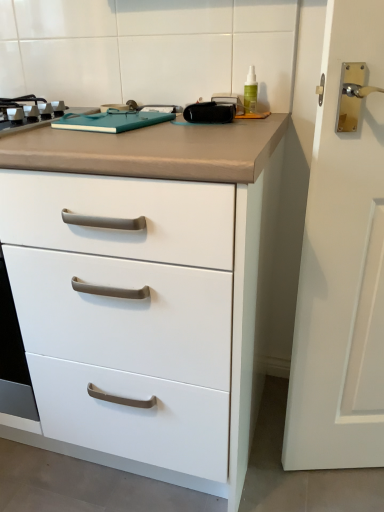
Question: Does white matte chest of drawers at center turn towards green translucent bottle at upper right?

Choices:
 (A) no
 (B) yes

Answer: (A)

Question: Is white matte chest of drawers at center far from green translucent bottle at upper right?

Choices:
 (A) no
 (B) yes

Answer: (A)

Question: Is white matte chest of drawers at center positioned beyond the bounds of green translucent bottle at upper right?

Choices:
 (A) yes
 (B) no

Answer: (A)

Question: Is white matte chest of drawers at center next to green translucent bottle at upper right and touching it?

Choices:
 (A) yes
 (B) no

Answer: (B)

Question: Considering the relative sizes of white matte chest of drawers at center and green translucent bottle at upper right in the image provided, is white matte chest of drawers at center bigger than green translucent bottle at upper right?

Choices:
 (A) yes
 (B) no

Answer: (A)

Question: Can you confirm if white matte chest of drawers at center is positioned to the right of green translucent bottle at upper right?

Choices:
 (A) yes
 (B) no

Answer: (B)

Question: Does metallic gray gas stove at upper left have a lesser width compared to white matte chest of drawers at center?

Choices:
 (A) yes
 (B) no

Answer: (A)

Question: Is white matte chest of drawers at center completely or partially inside metallic gray gas stove at upper left?

Choices:
 (A) no
 (B) yes

Answer: (A)

Question: Can you confirm if metallic gray gas stove at upper left is bigger than white matte chest of drawers at center?

Choices:
 (A) no
 (B) yes

Answer: (A)

Question: Does metallic gray gas stove at upper left have a smaller size compared to white matte chest of drawers at center?

Choices:
 (A) yes
 (B) no

Answer: (A)

Question: Considering the relative positions of metallic gray gas stove at upper left and white matte chest of drawers at center in the image provided, is metallic gray gas stove at upper left to the left of white matte chest of drawers at center from the viewer's perspective?

Choices:
 (A) yes
 (B) no

Answer: (A)

Question: From the image's perspective, is metallic gray gas stove at upper left below white matte chest of drawers at center?

Choices:
 (A) no
 (B) yes

Answer: (A)

Question: From a real-world perspective, is green translucent bottle at upper right positioned over white matte chest of drawers at center based on gravity?

Choices:
 (A) no
 (B) yes

Answer: (B)